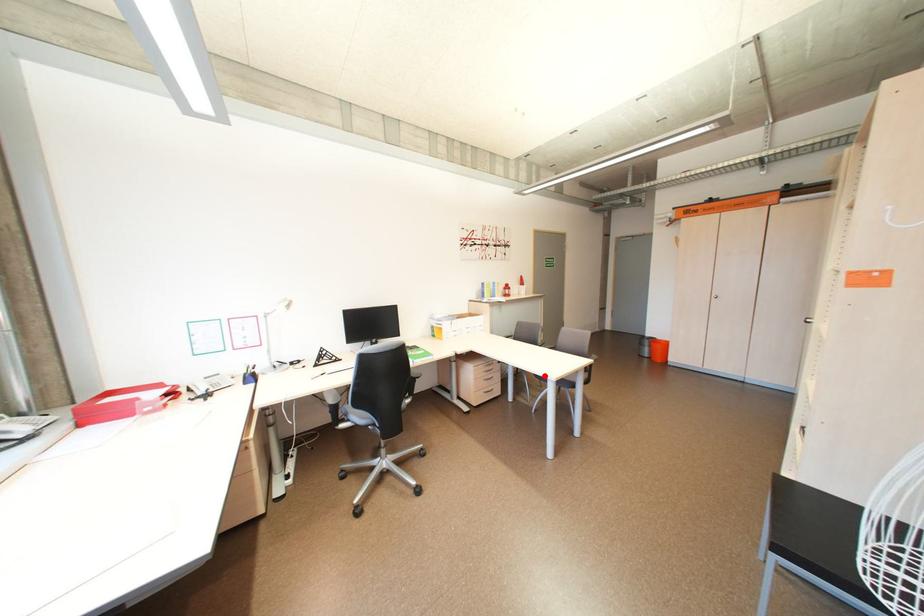
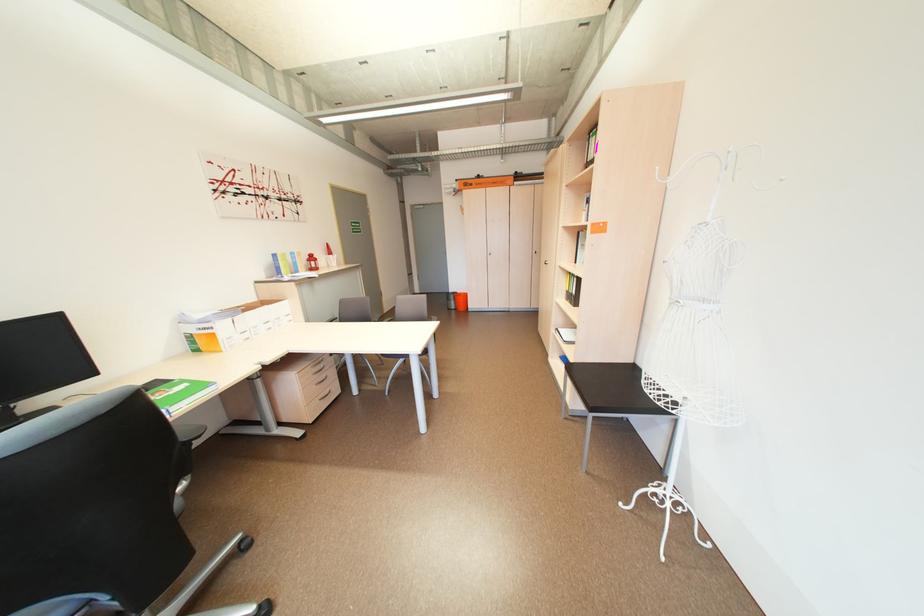
Find the pixel in the second image that matches the highlighted location in the first image.

(392, 355)